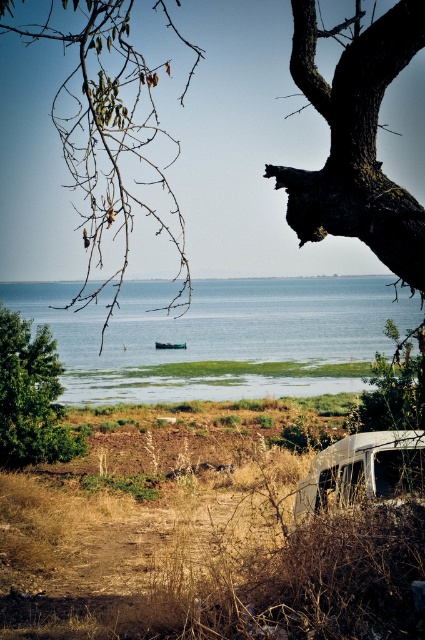
Question: Which object is the farthest from the green grassy water at center?

Choices:
 (A) green plastic boat at center
 (B) green leafy branch at left

Answer: (B)

Question: Is dark bark tree trunk at upper right above green plastic boat at center?

Choices:
 (A) no
 (B) yes

Answer: (B)

Question: Does dark bark tree trunk at upper right lie behind green plastic boat at center?

Choices:
 (A) yes
 (B) no

Answer: (B)

Question: Does rusty metal van at lower right have a greater width compared to green plastic boat at center?

Choices:
 (A) no
 (B) yes

Answer: (B)

Question: Which point is farther to the camera?

Choices:
 (A) dark bark tree trunk at upper right
 (B) green leafy tree at lower left
 (C) rusty metal van at lower right

Answer: (B)

Question: Which object appears farthest from the camera in this image?

Choices:
 (A) green grassy water at center
 (B) green leafy tree at lower left
 (C) green plastic boat at center

Answer: (C)